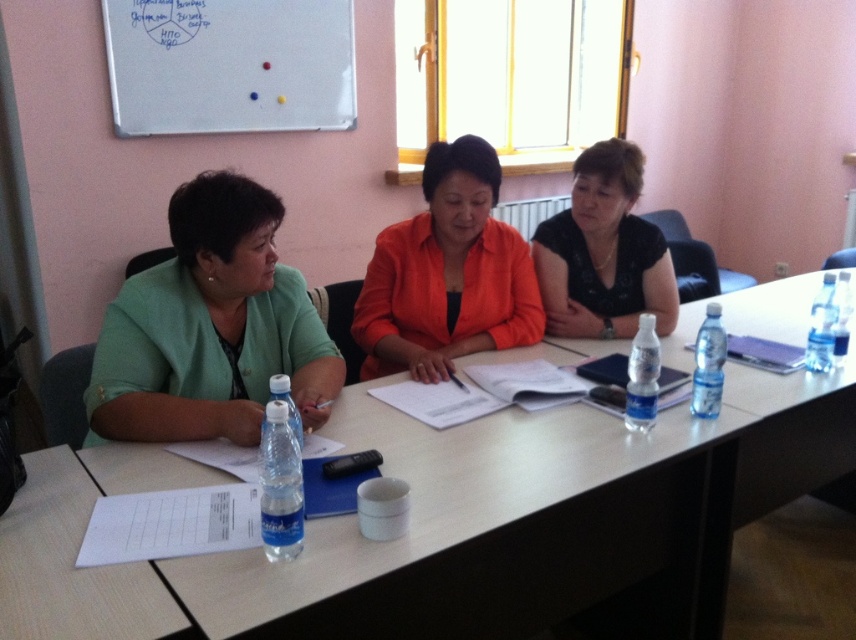
You are organizing a photo shoot and need to place a 1.2 meter wide backdrop behind the green fabric jacket at left and the black matte shirt at center. Will the backdrop be wide enough to cover both items?

The green fabric jacket at left is wider than the black matte shirt at center. Since the backdrop is 1.2 meters wide, it should be wide enough to cover both items as long as their combined width does not exceed 1.2 meters. However, the exact placement and orientation will determine coverage.

You are a person sitting at the table and need to reach both the green fabric jacket at left and the orange matte jacket at center. If your arm can extend 18 inches, can you comfortably reach both jackets without moving your chair?

The green fabric jacket at left is 18.80 inches away from the orange matte jacket at center. Since your arm can only extend 18 inches, you cannot comfortably reach both jackets without moving your chair because the distance between them exceeds your arm reach.